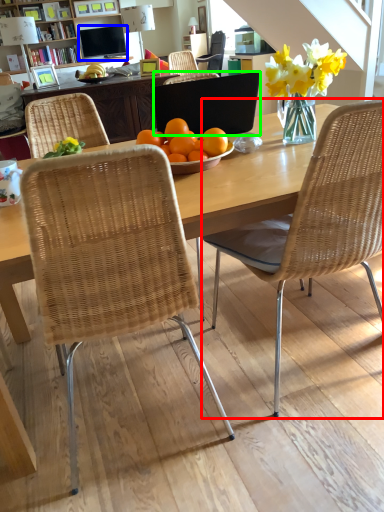
Question: Which object is the farthest from chair (highlighted by a red box)? Choose among these: television (highlighted by a blue box) or laptop (highlighted by a green box).

Choices:
 (A) television
 (B) laptop

Answer: (A)